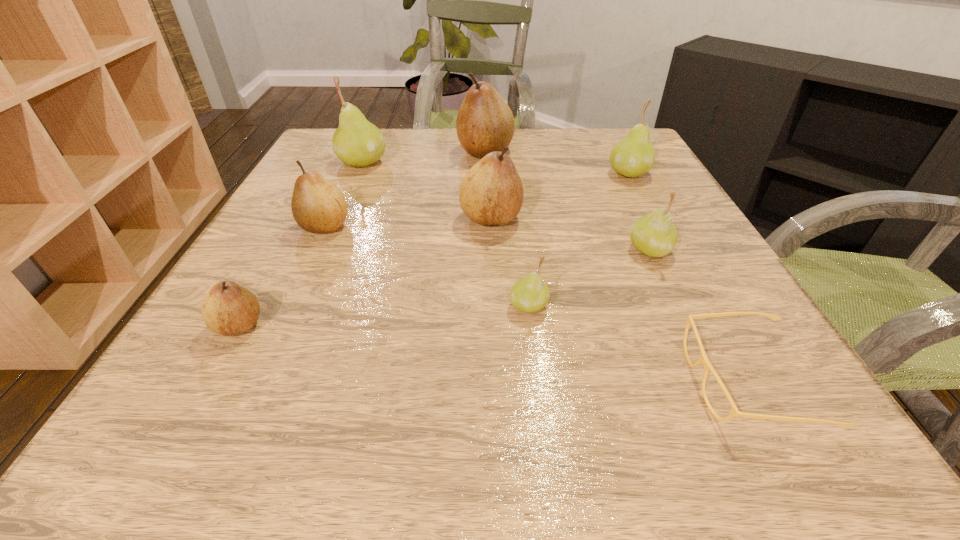
The width and height of the screenshot is (960, 540). What are the coordinates of `free location that satisfies the following two spatial constraints: 1. on the front side of the farthest brown pear; 2. on the right side of the second biggest brown pear` in the screenshot? It's located at (487, 218).